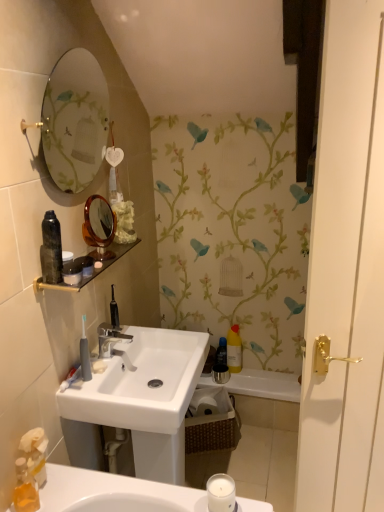
Identify the location of vacant space to the right of yellow matte bottle at center, the first toiletry positioned from the back. Image resolution: width=384 pixels, height=512 pixels. (271, 374).